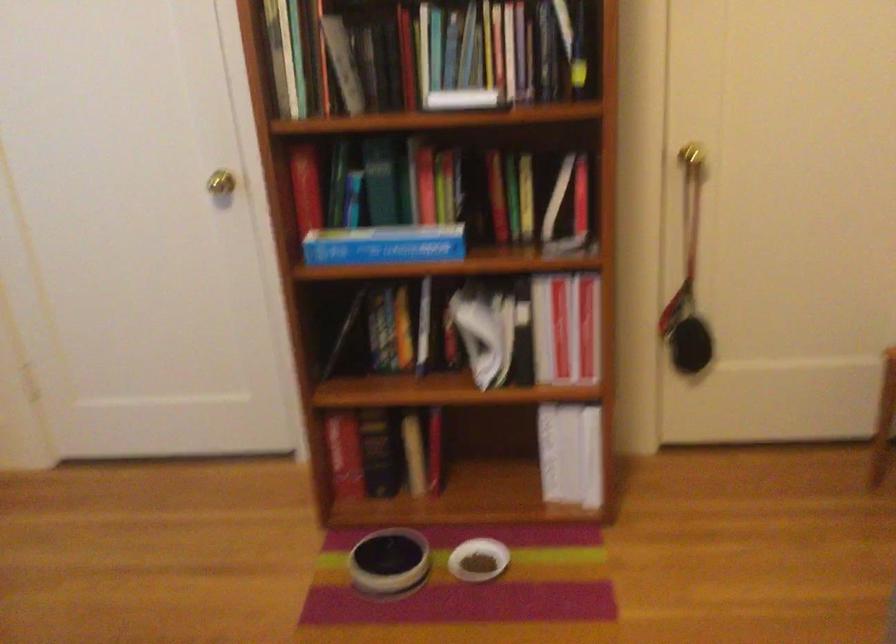
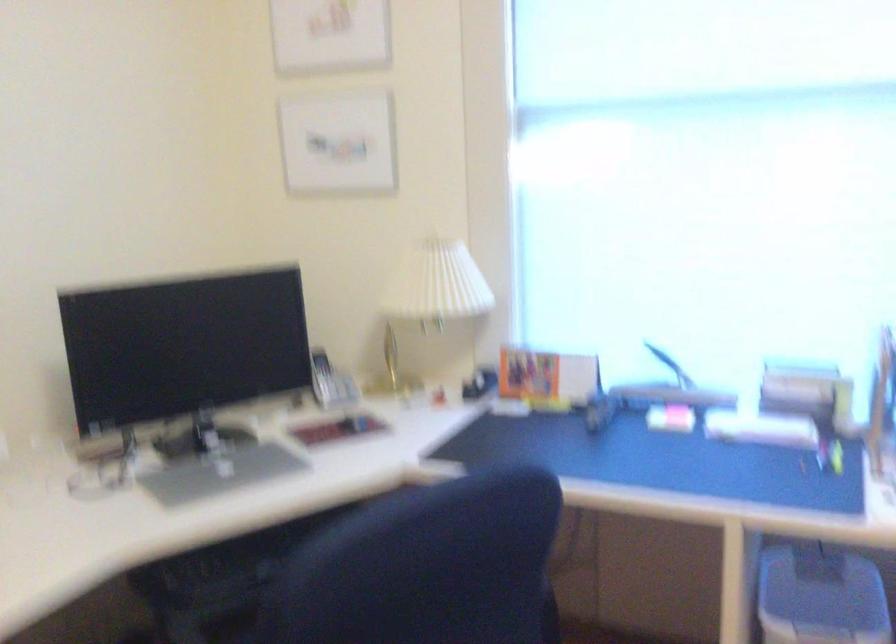
Based on the photo, first-person continuous shooting, in which direction is the camera rotating?

The rotation direction of the camera is left-down.